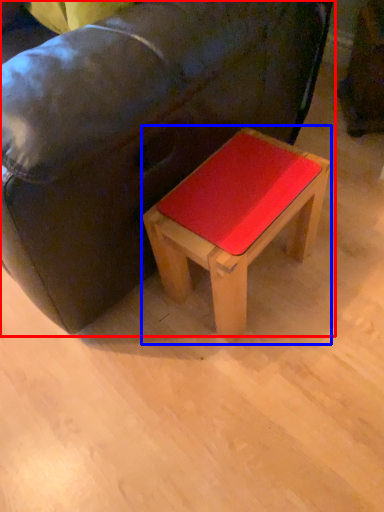
Question: Which object appears farthest to the camera in this image, studio couch (highlighted by a red box) or stool (highlighted by a blue box)?

Choices:
 (A) studio couch
 (B) stool

Answer: (B)